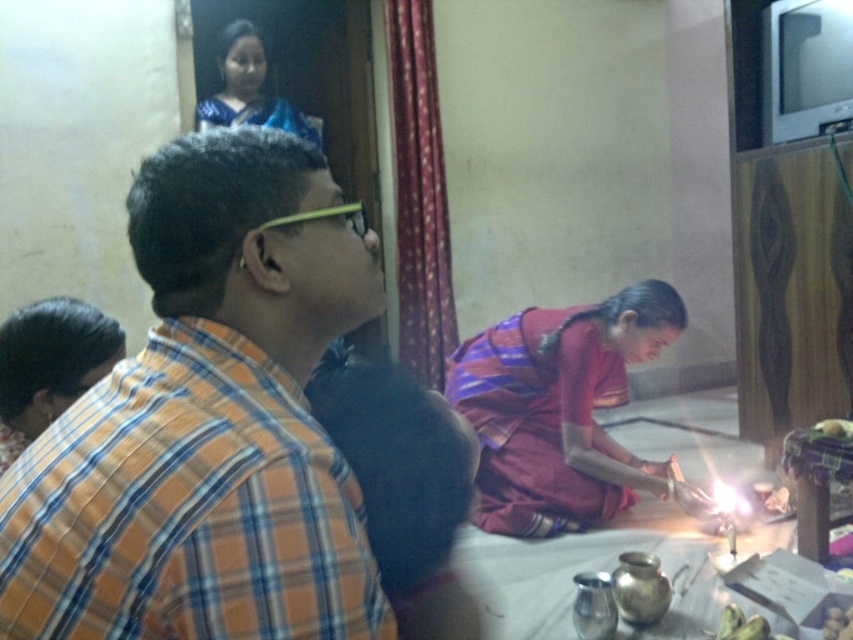
You are a fashion designer observing the domestic scene. You see the maroon silk saree at lower center and the blue sari at upper center. Which one is taller?

The maroon silk saree at lower center is much taller than the blue sari at upper center.

You are standing in the room and want to hang a painting on the wall. The blue sari at upper center is currently hanging there. Can you move it to a different location to make space for your painting?

The blue sari at upper center is currently located at point (x=248, y=88). Since it is an object that can be moved, you can relocate it to another position to make space for your painting.